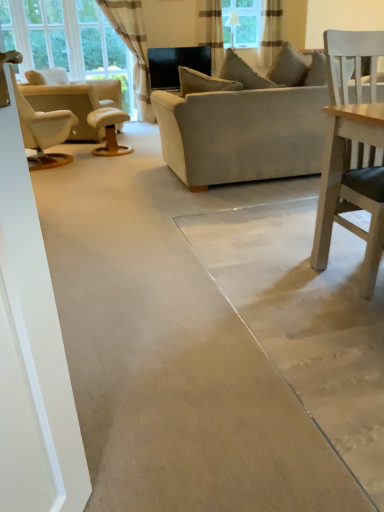
Question: In the image, is wooden stool at center on the left side or the right side of suede gray couch at center?

Choices:
 (A) left
 (B) right

Answer: (A)

Question: From the image's perspective, is wooden stool at center located above or below suede gray couch at center?

Choices:
 (A) below
 (B) above

Answer: (A)

Question: Which object is positioned closest to the striped fabric curtain at upper center, the 2th curtain from the right?

Choices:
 (A) suede gray couch at center
 (B) white leather recliner at left
 (C) white striped curtain at upper left, placed as the third curtain when sorted from right to left
 (D) wooden stool at center
 (E) striped fabric curtain at upper center, marked as the first curtain in a right-to-left arrangement

Answer: (E)

Question: Based on their relative distances, which object is farther from the striped fabric curtain at upper center, which is the second curtain from left to right?

Choices:
 (A) white striped curtain at upper left, placed as the third curtain when sorted from right to left
 (B) suede gray couch at center
 (C) white leather recliner at left
 (D) wooden stool at center
 (E) striped fabric curtain at upper center, marked as the first curtain in a right-to-left arrangement

Answer: (B)